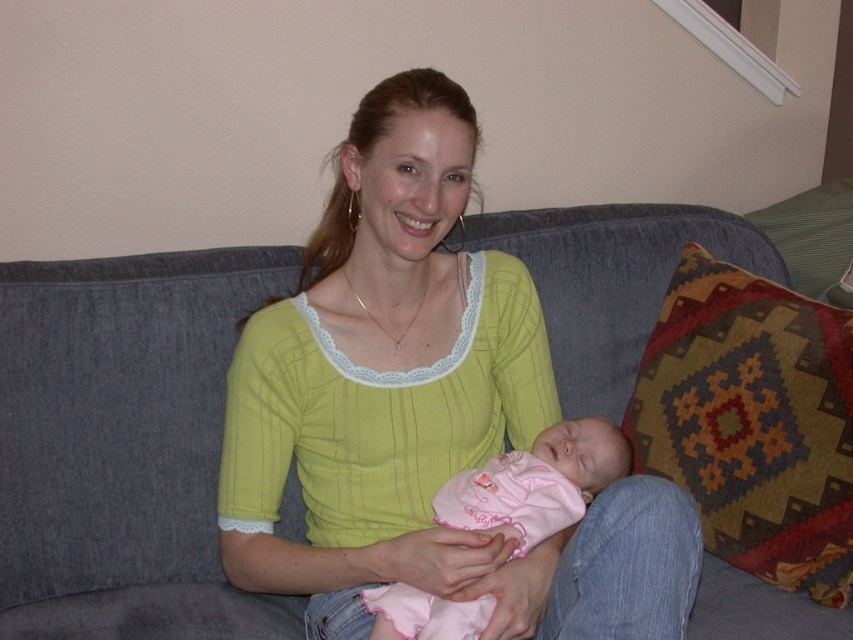
Does gray fabric couch at center have a lesser width compared to pink fabric baby at center?

No.

The width and height of the screenshot is (853, 640). What are the coordinates of `gray fabric couch at center` in the screenshot? It's located at (123, 444).

Is multicolored woven pillow at right thinner than pink fabric baby at center?

Yes, multicolored woven pillow at right is thinner than pink fabric baby at center.

Who is lower down, multicolored woven pillow at right or pink fabric baby at center?

pink fabric baby at center is lower down.

At what (x,y) coordinates should I click in order to perform the action: click on multicolored woven pillow at right. Please return your answer as a coordinate pair (x, y). Image resolution: width=853 pixels, height=640 pixels. Looking at the image, I should click on (752, 422).

Describe the element at coordinates (123, 444) in the screenshot. The image size is (853, 640). I see `gray fabric couch at center` at that location.

Is gray fabric couch at center bigger than multicolored woven pillow at right?

Indeed, gray fabric couch at center has a larger size compared to multicolored woven pillow at right.

Find the location of a particular element. This screenshot has width=853, height=640. gray fabric couch at center is located at coordinates (123, 444).